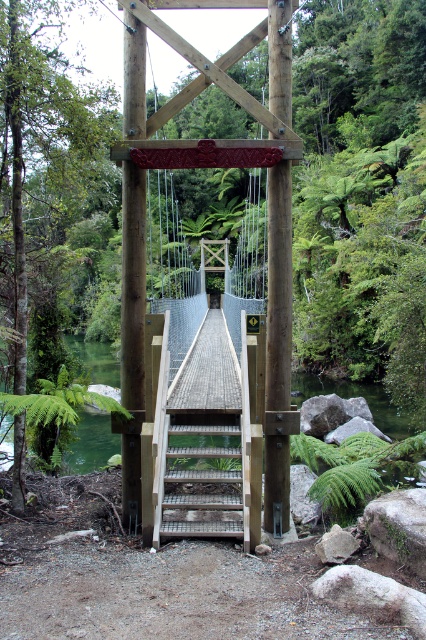
You are a hiker trying to cross the wooden suspension bridge. You notice the wooden stairs at center and the green water at center. Which one takes up more space in the image?

The green water at center takes up more space in the image than the wooden stairs at center.

You are standing at the bottom of the wooden stairs at center and want to reach the wooden suspension bridge at center. Which direction should you walk to get to the bridge?

You should walk upwards along the wooden stairs at center to reach the wooden suspension bridge at center, as it is located above the stairs.